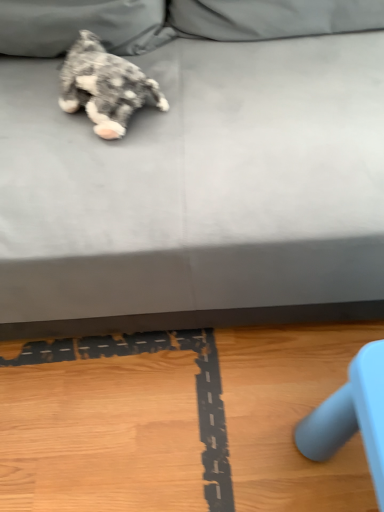
At what (x,y) coordinates should I click in order to perform the action: click on vacant space in front of fluffy gray dog at upper left. Please return your answer as a coordinate pair (x, y). The height and width of the screenshot is (512, 384). Looking at the image, I should click on (105, 168).